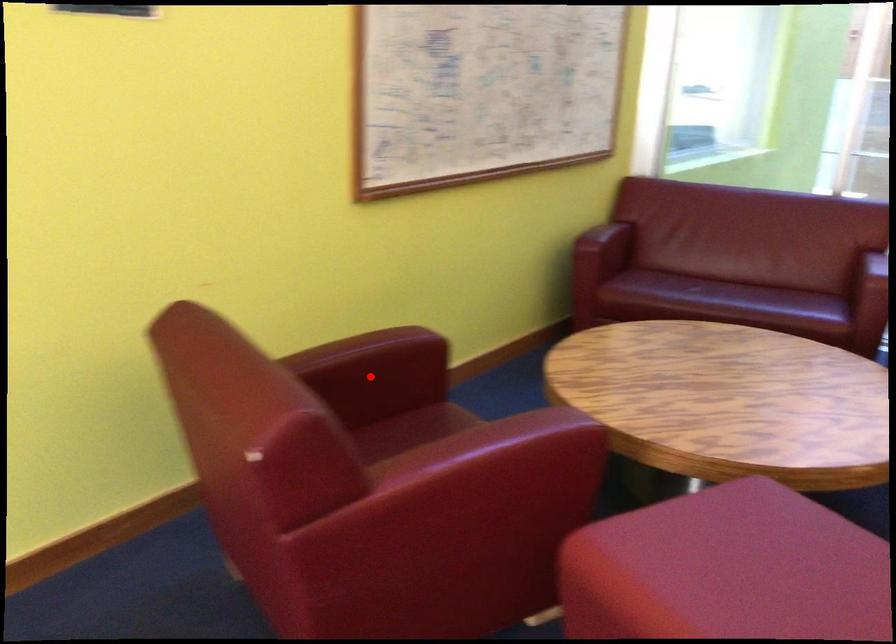
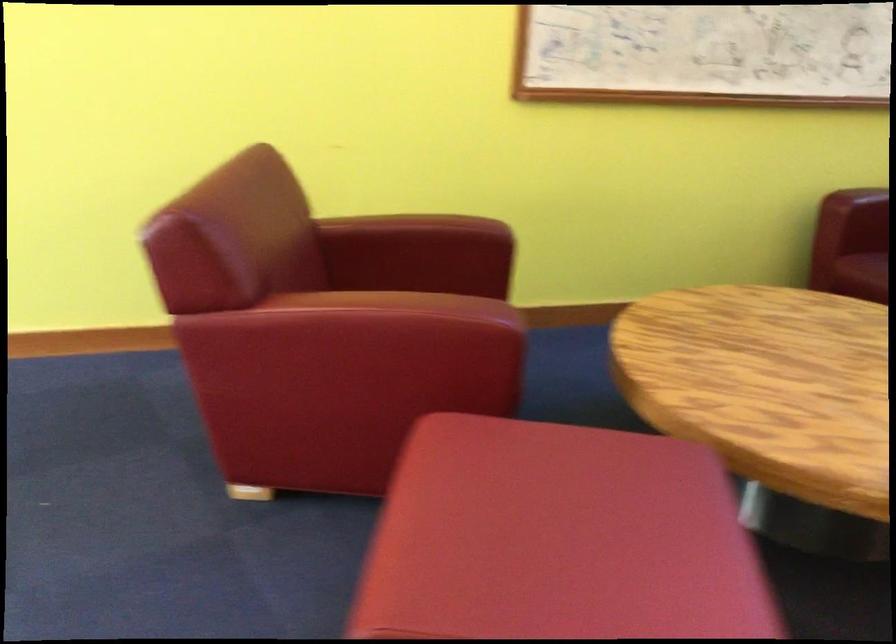
Find the pixel in the second image that matches the highlighted location in the first image.

(418, 254)